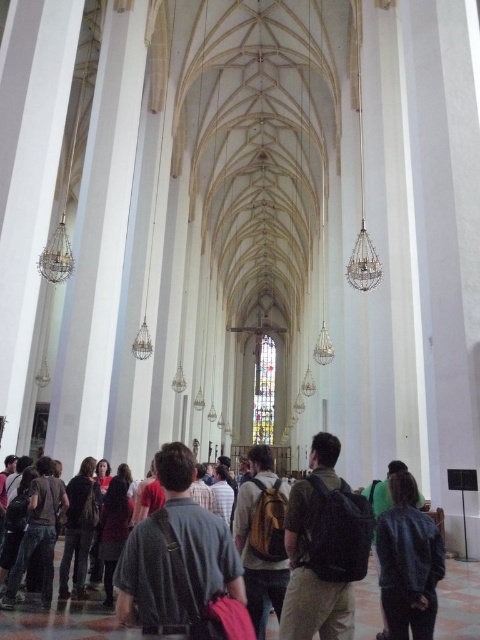
Based on the photo, you are standing in the cathedral and notice a dark brown backpack at center and a stained glass window at center. How far apart are these two objects?

The dark brown backpack at center is 547.40 feet away from the stained glass window at center.

You are a visitor in the cathedral and want to place your belongings on the floor near the altar. The dark gray backpack at center and the denim jacket at lower right are already there. Can you tell me which one takes up more space on the floor?

The dark gray backpack at center has a larger size compared to the denim jacket at lower right, so it takes up more space on the floor.